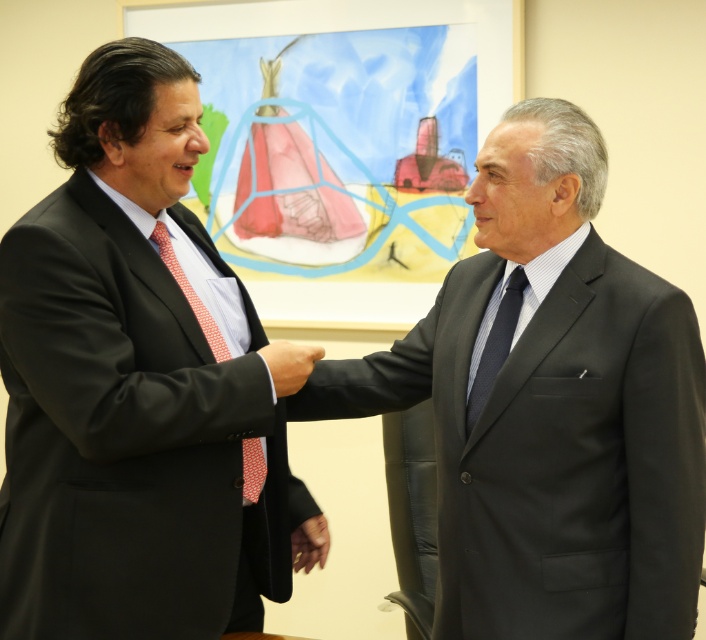
You are a photographer adjusting your camera to focus on the matte black suit at center and the red dotted tie at center. Which object should you focus on first if you want to ensure both are in focus?

The matte black suit at center is closer to the viewer than the red dotted tie at center, so focus on the matte black suit at center first to ensure both are in focus.

You are attending a business meeting and see two men in suits shaking hands at the center of the image. Which one is wearing the matte black suit at center located to the left of the dark gray suit at center?

The matte black suit at center is positioned on the left side of dark gray suit at center, so the man on the left is wearing the matte black suit at center.

You are a photographer standing in front of the two men shaking hands. You need to adjust your camera focus so that the dark blue textured tie at center and the black smooth suit at center are both in focus. Which object should you focus on first to ensure both are sharp?

The dark blue textured tie at center is in front of the black smooth suit at center, so you should focus on the dark blue textured tie at center first to ensure both are in focus.